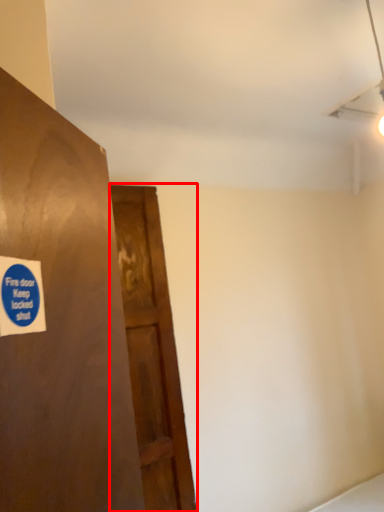
Question: Considering the relative positions of door (annotated by the red box) and sticker in the image provided, where is door (annotated by the red box) located with respect to the staircase?

Choices:
 (A) right
 (B) left

Answer: (A)